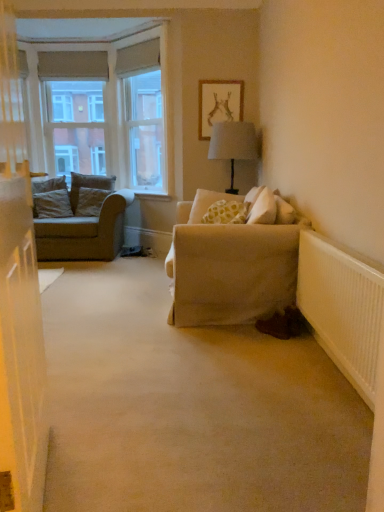
Where is `vacant space underneath white ribbed radiator at lower right (from a real-world perspective)`? vacant space underneath white ribbed radiator at lower right (from a real-world perspective) is located at coordinates (340, 377).